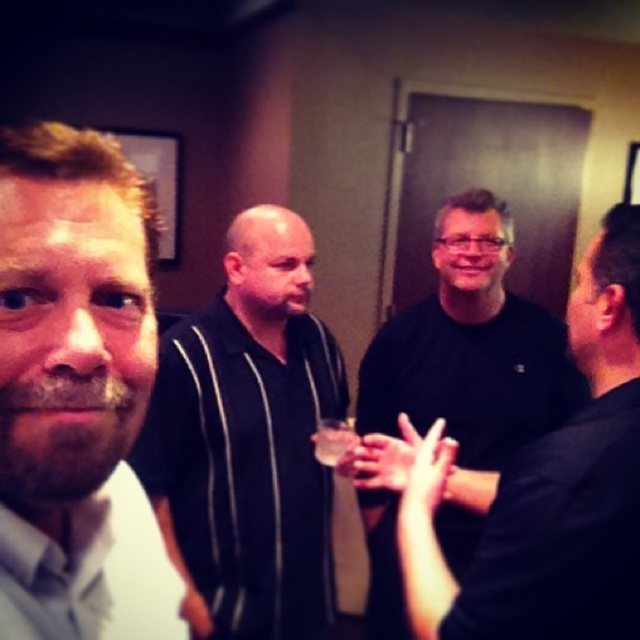
You are a photographer trying to capture the light brown hair at left and the translucent glass beverage at center in a single shot. Which object should you focus on first if you want both to be in sharp focus?

The light brown hair at left is larger in size than the translucent glass beverage at center, so focusing on the light brown hair at left first would ensure both are in sharp focus since it is closer to the camera.

You are standing at the entrance of the room and want to greet the person wearing the black striped shirt at center. Based on their position in the image, in which general direction should you walk to approach them?

The black striped shirt at center is positioned at point 0.700 on the x and 0.397 on the y, so you should walk towards the center right of the room to approach them.